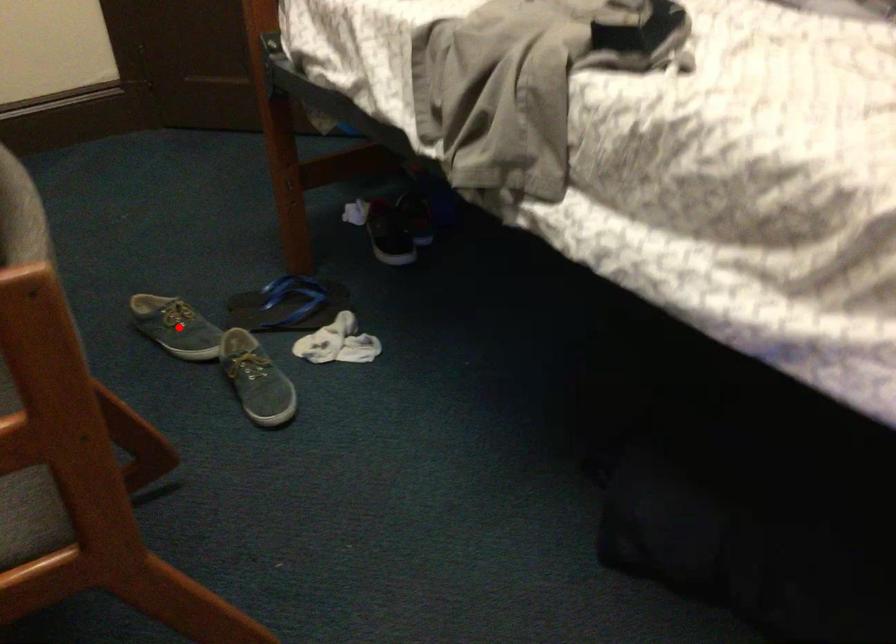
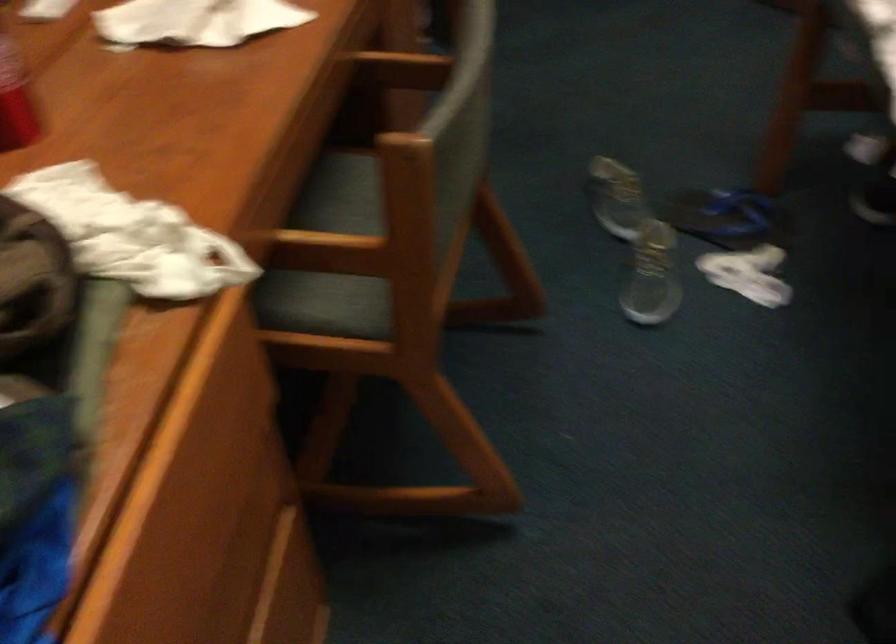
Locate, in the second image, the point that corresponds to the highlighted location in the first image.

(616, 198)